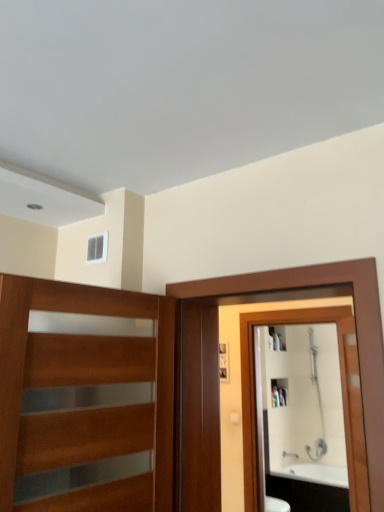
Locate an element on the screen. Image resolution: width=384 pixels, height=512 pixels. wooden with glass panels at left is located at coordinates (85, 398).

Describe the element at coordinates (97, 248) in the screenshot. I see `white plastic vent at upper center` at that location.

Measure the distance between point [281,393] and camera.

Point [281,393] and camera are 4.11 meters apart.

Identify the location of white glossy cabinet at upper center. This screenshot has height=512, width=384. (279, 392).

The image size is (384, 512). Identify the location of wooden with glass panels at left. (85, 398).

Would you say white plastic vent at upper center is inside or outside brown wooden screen door at right?

white plastic vent at upper center cannot be found inside brown wooden screen door at right.

Is white plastic vent at upper center at the left side of brown wooden screen door at right?

Yes, white plastic vent at upper center is to the left of brown wooden screen door at right.

Between white plastic vent at upper center and brown wooden screen door at right, which one has more height?

Standing taller between the two is brown wooden screen door at right.

Is white plastic vent at upper center oriented towards brown wooden screen door at right?

No, white plastic vent at upper center is not aimed at brown wooden screen door at right.

Can you confirm if white glossy mirror at right is bigger than white glossy cabinet at upper center?

Yes.

Considering the relative sizes of white glossy mirror at right and white glossy cabinet at upper center in the image provided, is white glossy mirror at right shorter than white glossy cabinet at upper center?

In fact, white glossy mirror at right may be taller than white glossy cabinet at upper center.

The width and height of the screenshot is (384, 512). I want to click on mirror on the left of the white glossy cabinet at upper center, so click(x=254, y=378).

Between white glossy mirror at right and white glossy cabinet at upper center, which one appears on the right side from the viewer's perspective?

white glossy cabinet at upper center is more to the right.

From the picture: Can you confirm if white plastic vent at upper center is positioned to the left of white glossy cabinet at upper center?

Yes.

Is white plastic vent at upper center facing away from white glossy cabinet at upper center?

Yes, white plastic vent at upper center is facing away from white glossy cabinet at upper center.

Where is `window in front of the white glossy cabinet at upper center`? Image resolution: width=384 pixels, height=512 pixels. window in front of the white glossy cabinet at upper center is located at coordinates (97, 248).

Is white plastic vent at upper center far away from white glossy cabinet at upper center?

white plastic vent at upper center is positioned a significant distance from white glossy cabinet at upper center.

Is brown wooden screen door at right positioned beyond the bounds of silver metallic faucet at lower right?

Absolutely, brown wooden screen door at right is external to silver metallic faucet at lower right.

Considering the positions of objects brown wooden screen door at right and silver metallic faucet at lower right in the image provided, who is more to the left, brown wooden screen door at right or silver metallic faucet at lower right?

From the viewer's perspective, brown wooden screen door at right appears more on the left side.

From the image's perspective, which one is positioned lower, brown wooden screen door at right or silver metallic faucet at lower right?

From the image's view, silver metallic faucet at lower right is below.

Based on the photo, from a real-world perspective, is brown wooden screen door at right positioned above or below silver metallic faucet at lower right?

From a real-world perspective, brown wooden screen door at right is physically above silver metallic faucet at lower right.

Can we say wooden with glass panels at left lies outside white glossy cabinet at upper center?

Absolutely, wooden with glass panels at left is external to white glossy cabinet at upper center.

From a real-world perspective, is wooden with glass panels at left physically located above or below white glossy cabinet at upper center?

From a real-world perspective, wooden with glass panels at left is physically above white glossy cabinet at upper center.

Would you say wooden with glass panels at left is a long distance from white glossy cabinet at upper center?

wooden with glass panels at left is far away from white glossy cabinet at upper center.

Is point (29, 326) less distant than point (278, 398)?

That is True.

Who is shorter, wooden with glass panels at left or white glossy mirror at right?

wooden with glass panels at left is shorter.

From the image's perspective, is wooden with glass panels at left beneath white glossy mirror at right?

Actually, wooden with glass panels at left appears above white glossy mirror at right in the image.

Is wooden with glass panels at left oriented towards white glossy mirror at right?

No, wooden with glass panels at left is not turned towards white glossy mirror at right.

Would you say wooden with glass panels at left contains white glossy mirror at right?

Definitely not — white glossy mirror at right is not inside wooden with glass panels at left.

How much distance is there between brown wooden screen door at right and white glossy cabinet at upper center?

brown wooden screen door at right and white glossy cabinet at upper center are 7.56 feet apart.

Which is behind, brown wooden screen door at right or white glossy cabinet at upper center?

white glossy cabinet at upper center is further away from the camera.

Could you tell me if brown wooden screen door at right is facing white glossy cabinet at upper center?

No.

Considering the sizes of objects brown wooden screen door at right and white glossy cabinet at upper center in the image provided, who is taller, brown wooden screen door at right or white glossy cabinet at upper center?

brown wooden screen door at right.

Where is `window above the brown wooden screen door at right (from the image's perspective)`? This screenshot has width=384, height=512. window above the brown wooden screen door at right (from the image's perspective) is located at coordinates (97, 248).

Locate an element on the screen. This screenshot has height=512, width=384. mirror in front of the white glossy cabinet at upper center is located at coordinates (254, 378).

When comparing their distances from white glossy cabinet at upper center, does white glossy mirror at right or white plastic vent at upper center seem closer?

Based on the image, white glossy mirror at right appears to be nearer to white glossy cabinet at upper center.

In the scene shown: When comparing their distances from white plastic vent at upper center, does silver metallic faucet at lower right or brown wooden screen door at right seem closer?

Based on the image, brown wooden screen door at right appears to be nearer to white plastic vent at upper center.

From the image, which object appears to be nearer to white plastic vent at upper center, wooden with glass panels at left or brown wooden screen door at right?

wooden with glass panels at left is closer to white plastic vent at upper center.

Looking at the image, which one is located closer to wooden with glass panels at left, brown wooden screen door at right or white glossy mirror at right?

The object closer to wooden with glass panels at left is brown wooden screen door at right.

Estimate the real-world distances between objects in this image. Which object is closer to wooden with glass panels at left, white glossy mirror at right or brown wooden screen door at right?

brown wooden screen door at right is positioned closer to the anchor wooden with glass panels at left.

Based on their spatial positions, is white glossy cabinet at upper center or white plastic vent at upper center closer to silver metallic faucet at lower right?

The object closer to silver metallic faucet at lower right is white glossy cabinet at upper center.

Looking at the image, which one is located further to brown wooden screen door at right, wooden with glass panels at left or white glossy cabinet at upper center?

The object further to brown wooden screen door at right is white glossy cabinet at upper center.

Based on the photo, when comparing their distances from white plastic vent at upper center, does white glossy mirror at right or white glossy cabinet at upper center seem closer?

Based on the image, white glossy mirror at right appears to be nearer to white plastic vent at upper center.

In order to click on window positioned between brown wooden screen door at right and white glossy mirror at right from near to far in this screenshot , I will do `click(97, 248)`.

Locate an element on the screen. The width and height of the screenshot is (384, 512). faucet between wooden with glass panels at left and white glossy cabinet at upper center along the z-axis is located at coordinates (290, 454).

You are a GUI agent. You are given a task and a screenshot of the screen. Output one action in this format:
    pyautogui.click(x=<x>, y=<y>)
    Task: Click on the window between wooden with glass panels at left and white glossy mirror at right from front to back
    The height and width of the screenshot is (512, 384).
    Given the screenshot: What is the action you would take?
    pyautogui.click(x=97, y=248)

The image size is (384, 512). Find the location of `window between brown wooden screen door at right and white glossy cabinet at upper center from front to back`. window between brown wooden screen door at right and white glossy cabinet at upper center from front to back is located at coordinates (97, 248).